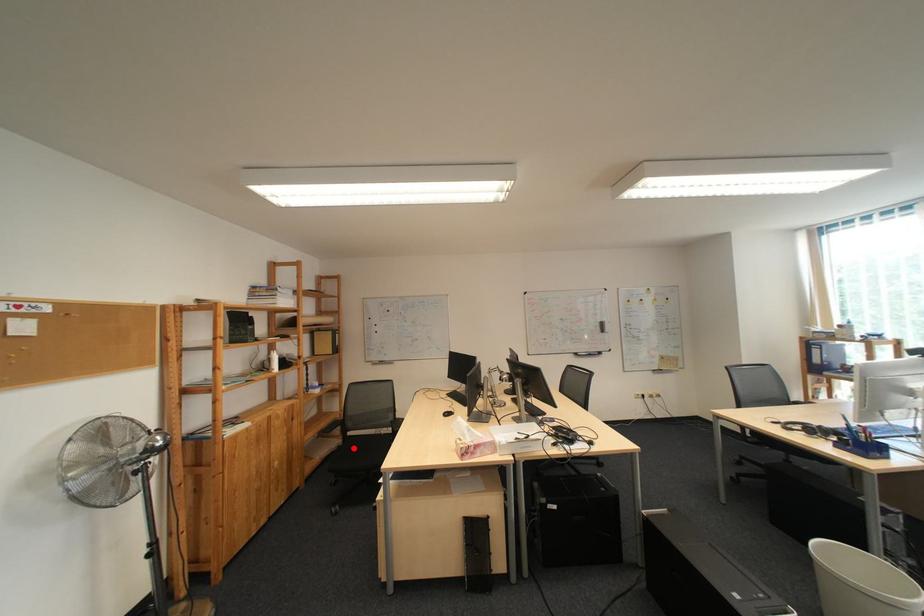
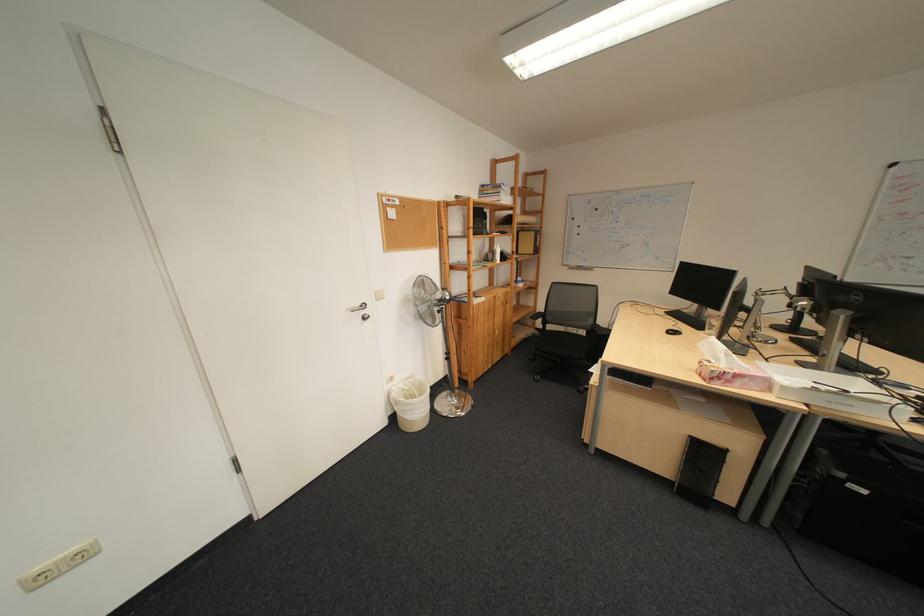
The point at the highlighted location is marked in the first image. Where is the corresponding point in the second image?

(548, 336)